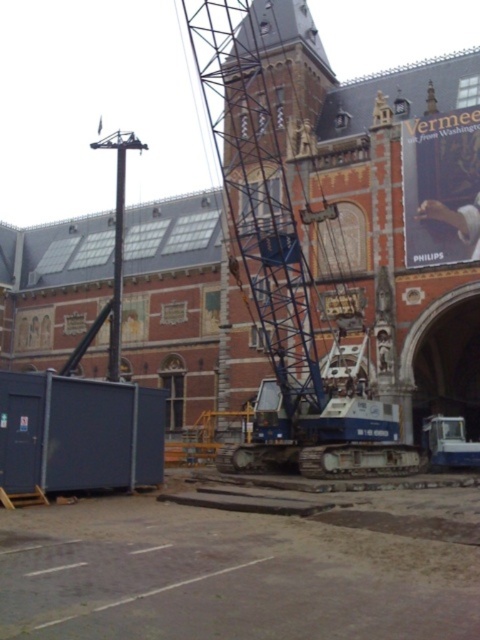
Question: Which object is the farthest from the metallic blue crane at center?

Choices:
 (A) blue metallic crane at center
 (B) metallic blue container at lower left

Answer: (A)

Question: Which object appears farthest from the camera in this image?

Choices:
 (A) blue metallic crane at center
 (B) metallic blue crane at center
 (C) metallic blue container at lower left

Answer: (B)

Question: Can you confirm if metallic blue container at lower left is positioned to the left of metallic blue crane at center?

Choices:
 (A) no
 (B) yes

Answer: (B)

Question: Which object is positioned farthest from the blue metallic crane at center?

Choices:
 (A) metallic blue container at lower left
 (B) metallic blue crane at center

Answer: (B)

Question: Does blue metallic crane at center come behind metallic blue crane at center?

Choices:
 (A) no
 (B) yes

Answer: (A)

Question: Can you confirm if metallic blue container at lower left is positioned above metallic blue crane at center?

Choices:
 (A) yes
 (B) no

Answer: (A)